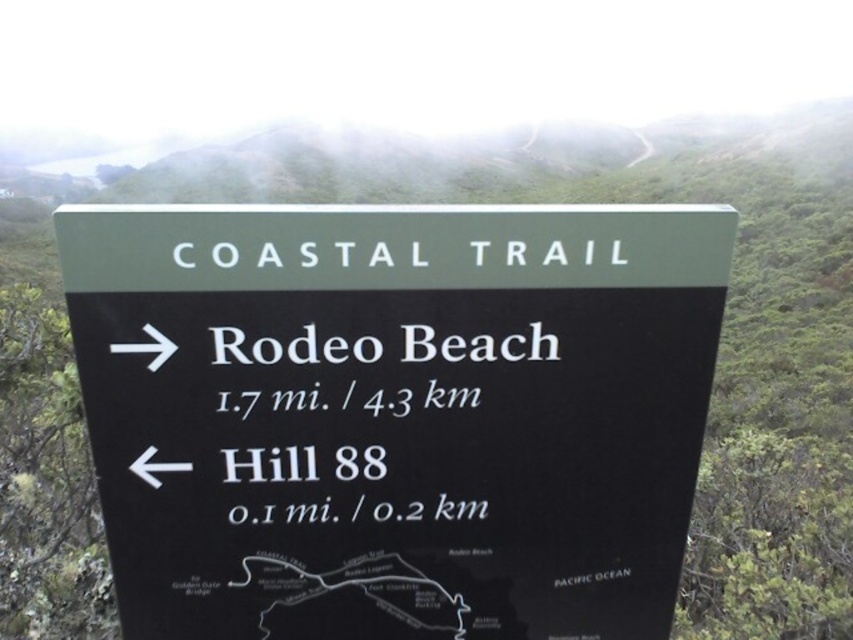
Question: Considering the relative positions of black plastic sign at center and white text sign at center in the image provided, where is black plastic sign at center located with respect to white text sign at center?

Choices:
 (A) left
 (B) right

Answer: (B)

Question: Does black plastic sign at center have a smaller size compared to white text sign at center?

Choices:
 (A) yes
 (B) no

Answer: (B)

Question: Is black plastic sign at center closer to the viewer compared to white text sign at center?

Choices:
 (A) yes
 (B) no

Answer: (A)